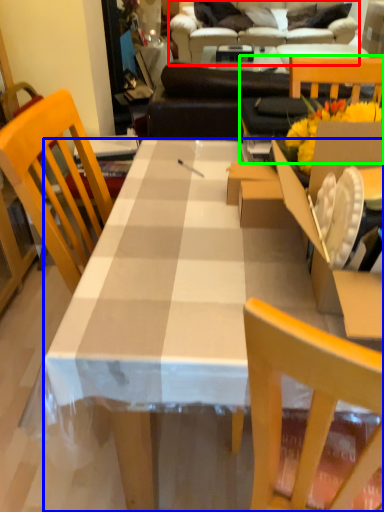
Question: Which object is the closest to the studio couch (highlighted by a red box)? Choose among these: desk (highlighted by a blue box) or chair (highlighted by a green box).

Choices:
 (A) desk
 (B) chair

Answer: (B)